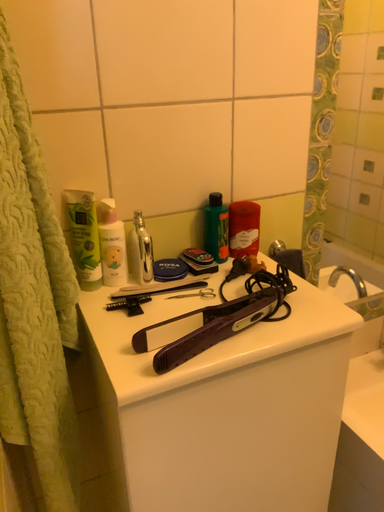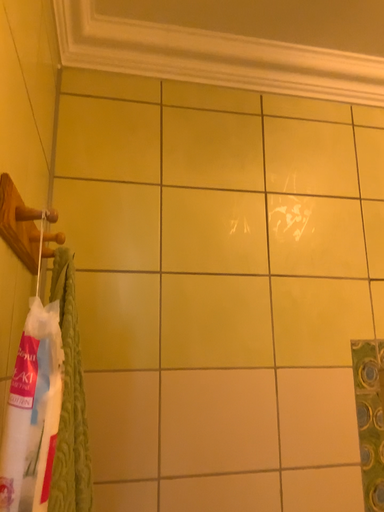
Question: How did the camera likely rotate when shooting the video?

Choices:
 (A) rotated downward
 (B) rotated upward

Answer: (B)